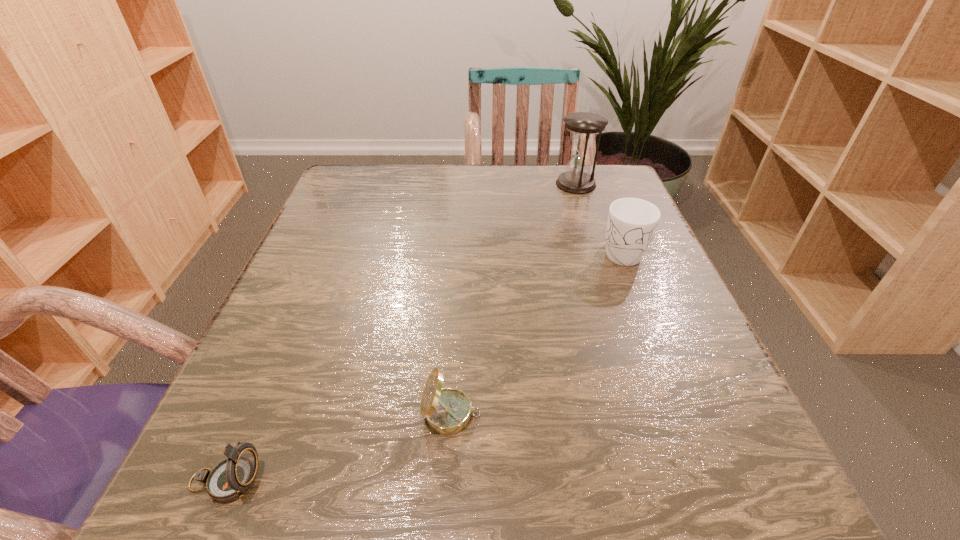
The image size is (960, 540). In order to click on free space located 0.190m with the dial facing the right compass in this screenshot , I will do `click(619, 414)`.

Image resolution: width=960 pixels, height=540 pixels. I want to click on free region located on the face of the nearer compass, so (458, 481).

In order to click on object that is positioned at the far edge in this screenshot , I will do `click(584, 126)`.

This screenshot has height=540, width=960. In order to click on object that is positioned at the near edge in this screenshot , I will do `click(230, 479)`.

In order to click on object present at the left edge in this screenshot , I will do `click(230, 479)`.

At what (x,y) coordinates should I click in order to perform the action: click on hourglass at the right edge. Please return your answer as a coordinate pair (x, y). The image size is (960, 540). Looking at the image, I should click on (584, 126).

Locate an element on the screen. This screenshot has width=960, height=540. mug located in the right edge section of the desktop is located at coordinates (632, 222).

This screenshot has height=540, width=960. I want to click on object that is at the near left corner, so click(230, 479).

Locate an element on the screen. Image resolution: width=960 pixels, height=540 pixels. object positioned at the far right corner is located at coordinates (584, 126).

I want to click on vacant space at the far edge of the desktop, so click(486, 184).